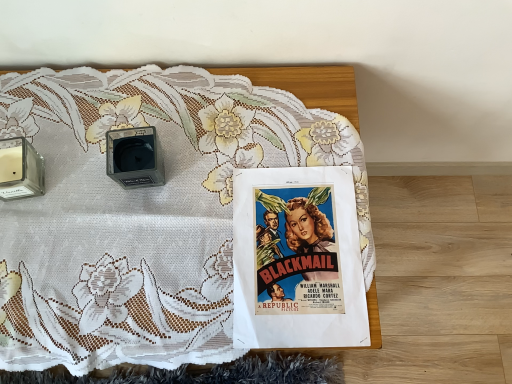
Where is `vacant location behind matte black speaker at center, placed as the 1th speaker when sorted from right to left`? Image resolution: width=512 pixels, height=384 pixels. vacant location behind matte black speaker at center, placed as the 1th speaker when sorted from right to left is located at coordinates (141, 99).